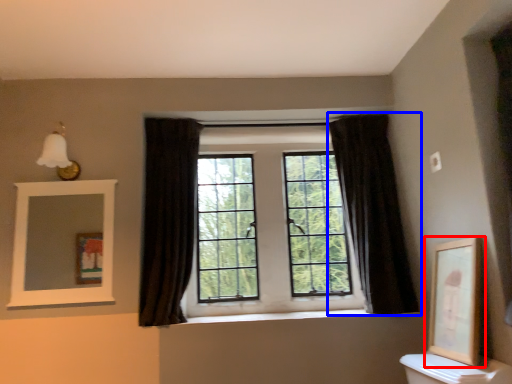
Question: Which object appears farthest to the camera in this image, picture frame (highlighted by a red box) or curtain (highlighted by a blue box)?

Choices:
 (A) picture frame
 (B) curtain

Answer: (B)